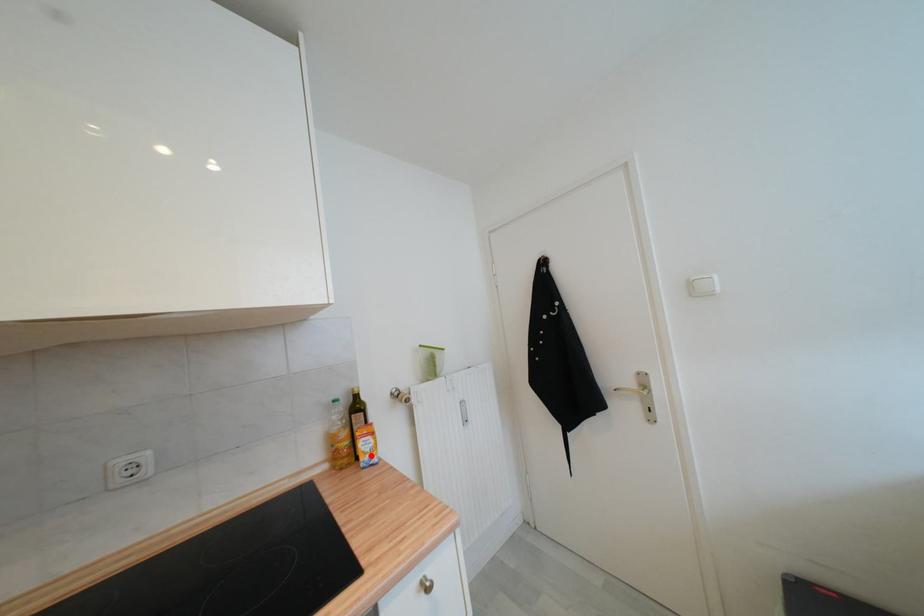
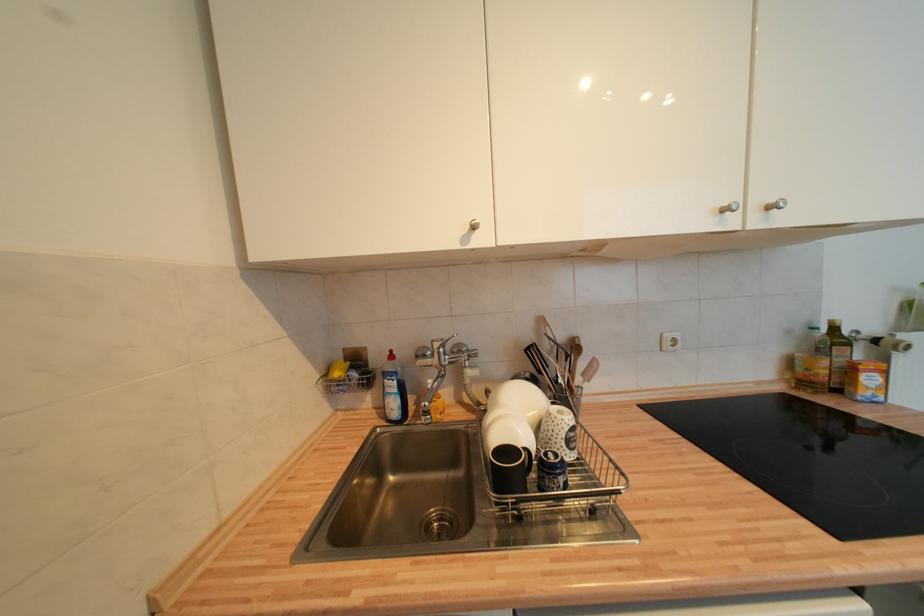
Question: I am providing you with two images of the same scene from different viewpoints. A red point is marked on the first image. Is the red point's position out of view in image 2?

Choices:
 (A) Yes
 (B) No

Answer: (B)